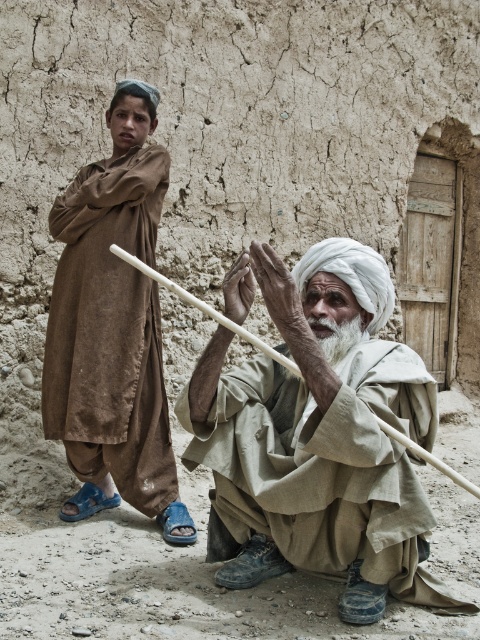
Question: Which object is positioned closest to the light beige fabric at center?

Choices:
 (A) brown cotton robe at left
 (B) white soft beard at center

Answer: (B)

Question: Is light beige fabric at center thinner than brown cotton robe at left?

Choices:
 (A) no
 (B) yes

Answer: (A)

Question: Is light beige fabric at center above brown cotton robe at left?

Choices:
 (A) no
 (B) yes

Answer: (A)

Question: Among these points, which one is farthest from the camera?

Choices:
 (A) (339, 330)
 (B) (127, 193)
 (C) (228, 488)

Answer: (B)

Question: Is light beige fabric at center behind white soft beard at center?

Choices:
 (A) yes
 (B) no

Answer: (B)

Question: Which point is closer to the camera?

Choices:
 (A) (66, 189)
 (B) (340, 332)

Answer: (B)